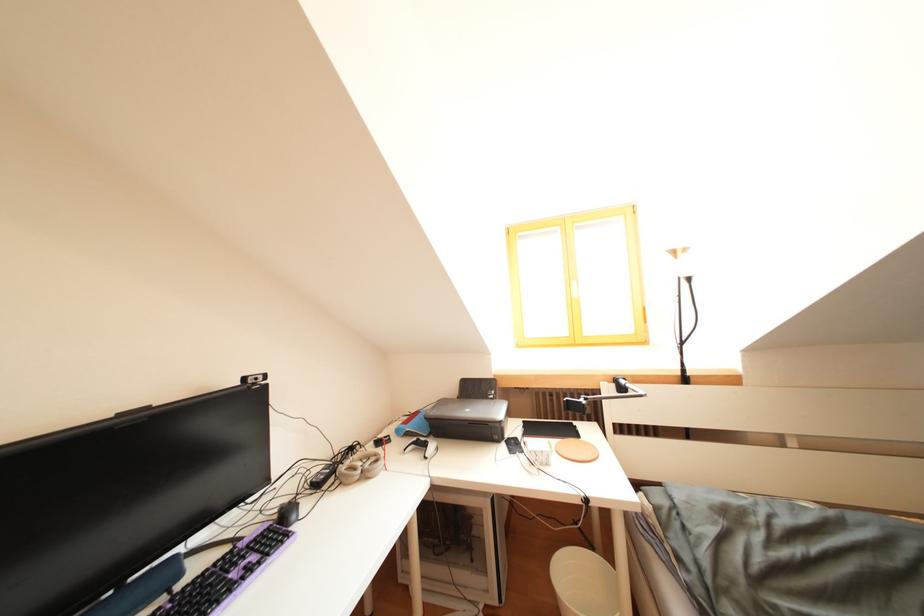
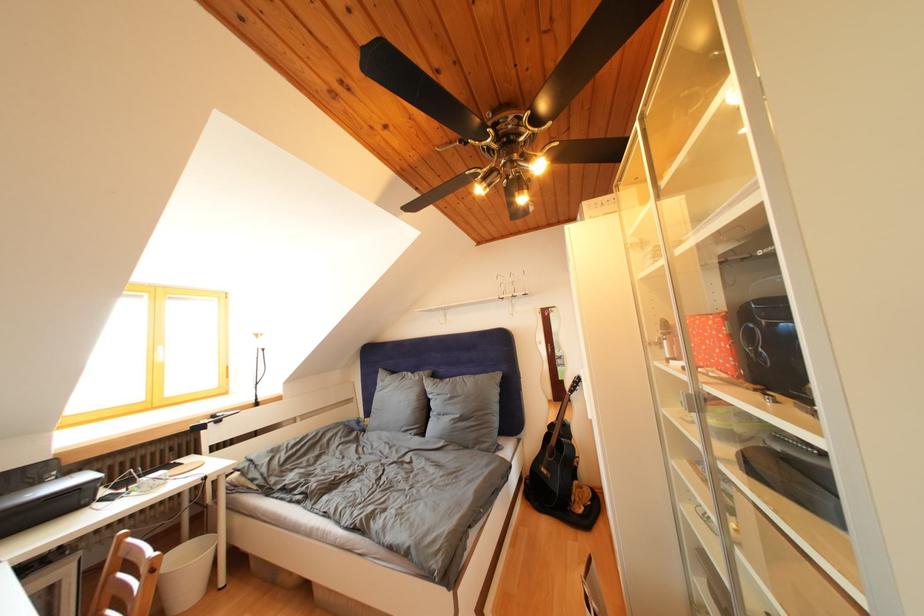
Locate, in the second image, the point that corresponds to [492,400] in the first image.

(44, 488)